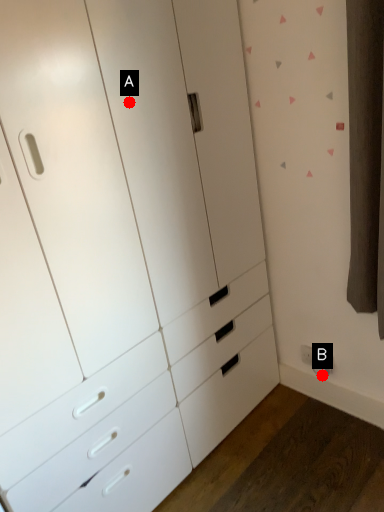
Question: Two points are circled on the image, labeled by A and B beside each circle. Among these points, which one is farthest from the camera?

Choices:
 (A) A is further
 (B) B is further

Answer: (B)